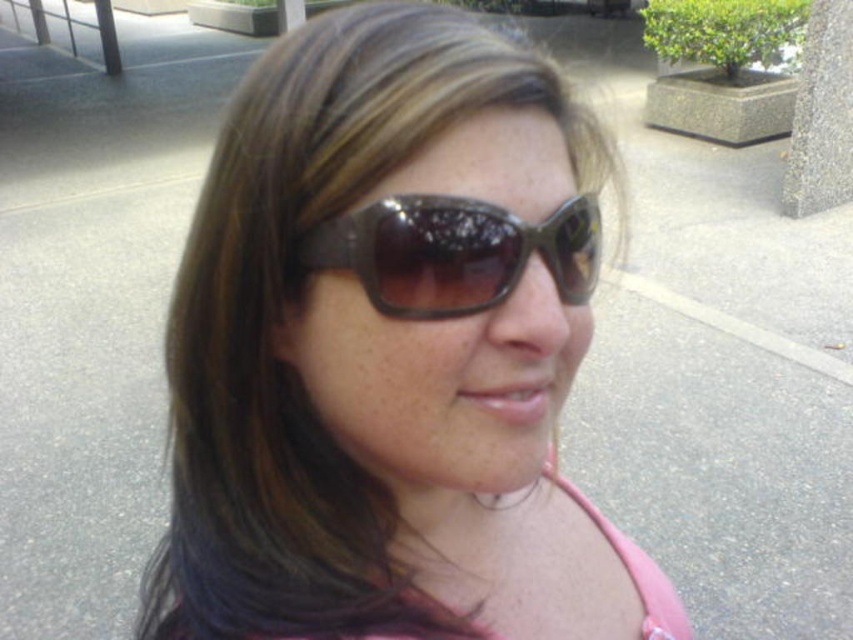
Question: Does matte brown sunglasses at center appear on the left side of shiny brown sunglasses at center?

Choices:
 (A) yes
 (B) no

Answer: (A)

Question: Does matte brown sunglasses at center appear under shiny brown sunglasses at center?

Choices:
 (A) yes
 (B) no

Answer: (A)

Question: Can you confirm if matte brown sunglasses at center is positioned above shiny brown sunglasses at center?

Choices:
 (A) yes
 (B) no

Answer: (B)